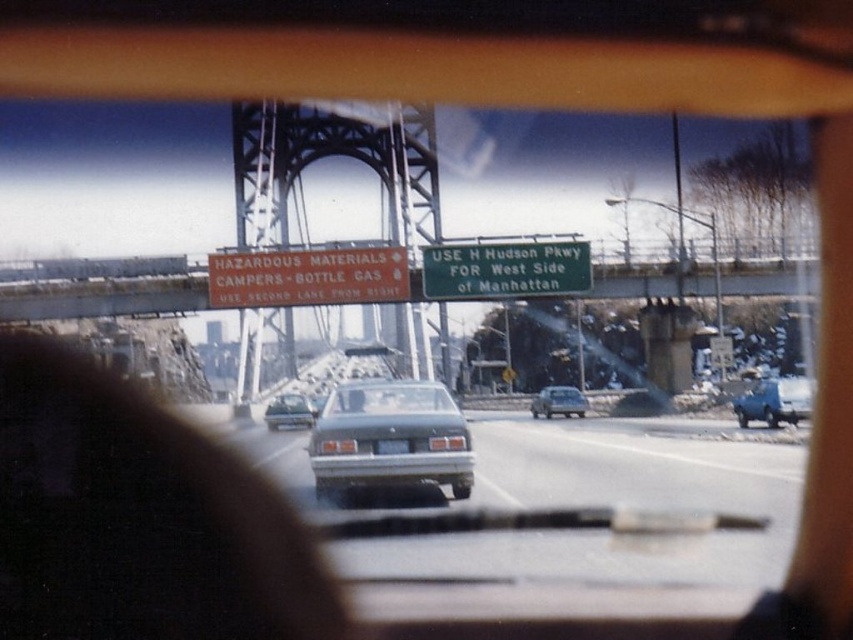
Question: Among these objects, which one is nearest to the camera?

Choices:
 (A) green matte sign at center
 (B) satin silver sedan at center

Answer: (B)

Question: From the image, what is the correct spatial relationship of blue matte van at right in relation to black plastic license plate at center?

Choices:
 (A) left
 (B) right

Answer: (B)

Question: Which of the following is the closest to the observer?

Choices:
 (A) blue matte van at right
 (B) metallic gray bridge at center-left
 (C) green matte sign at center

Answer: (A)

Question: Observing the image, what is the correct spatial positioning of metallic gray bridge at center-left in reference to black plastic license plate at center?

Choices:
 (A) below
 (B) above

Answer: (B)

Question: Considering the real-world distances, which object is farthest from the satin silver sedan at center?

Choices:
 (A) matte gray sedan at center
 (B) green matte sign at center
 (C) blue matte van at right

Answer: (C)

Question: From the image, what is the correct spatial relationship of smokey gray sedan at center in relation to blue matte van at right?

Choices:
 (A) below
 (B) above

Answer: (B)